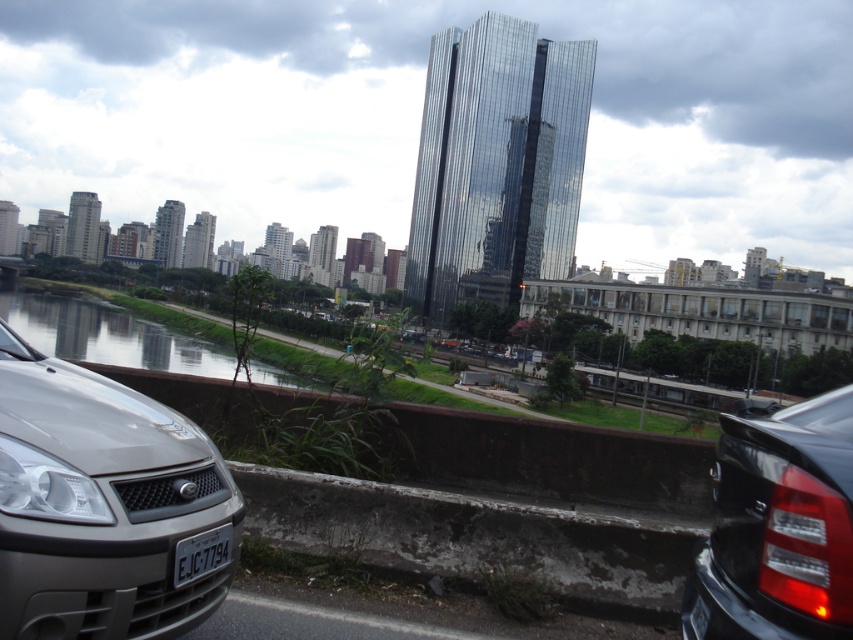
Question: Which object appears closest to the camera in this image?

Choices:
 (A) satin silver car at lower left
 (B) white plastic license plate at lower center
 (C) reflective glass waterway at left
 (D) black glossy car at right

Answer: (D)

Question: Can you confirm if black glossy car at right is smaller than white plastic license plate at lower center?

Choices:
 (A) no
 (B) yes

Answer: (A)

Question: Which point is closer to the camera?

Choices:
 (A) (132, 492)
 (B) (193, 573)

Answer: (A)

Question: Is satin silver car at lower left wider than black glossy car at right?

Choices:
 (A) no
 (B) yes

Answer: (A)

Question: Can you confirm if satin silver car at lower left is thinner than black glossy car at right?

Choices:
 (A) yes
 (B) no

Answer: (A)

Question: Which of these objects is positioned closest to the satin silver car at lower left?

Choices:
 (A) white plastic license plate at lower center
 (B) black glossy car at right

Answer: (A)